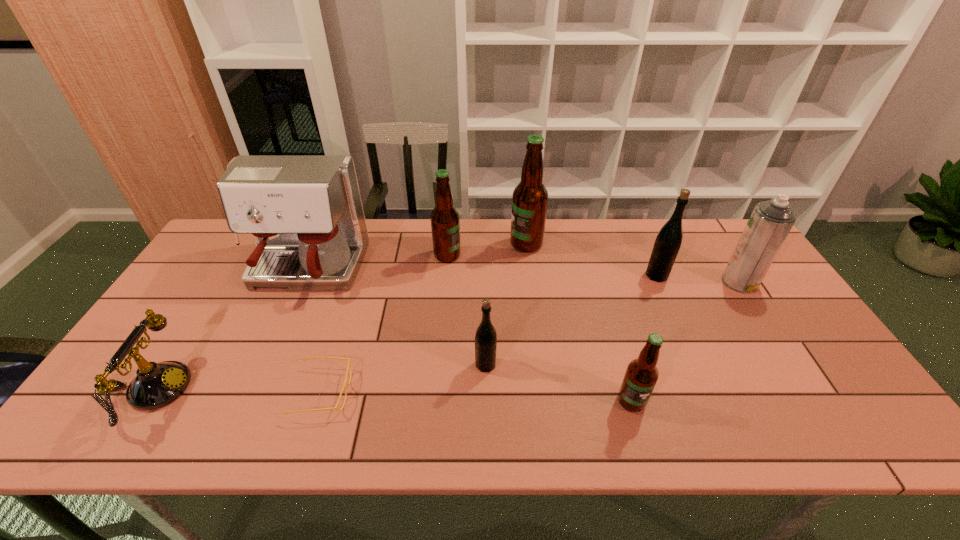
The image size is (960, 540). Find the location of `blank area located on the label of the sixth object from right to left`. blank area located on the label of the sixth object from right to left is located at coordinates (511, 255).

You are a GUI agent. You are given a task and a screenshot of the screen. Output one action in this format:
    pyautogui.click(x=<x>, y=<y>)
    Task: Click on the vacant region located 0.320m on the front of the right green beer bottle
    Image resolution: width=960 pixels, height=540 pixels.
    Given the screenshot: What is the action you would take?
    pyautogui.click(x=700, y=372)

The image size is (960, 540). Find the location of `vacant area situated on the left of the rightmost object`. vacant area situated on the left of the rightmost object is located at coordinates (666, 282).

Identify the location of free space located 0.310m on the left of the fourth beer bottle from right to left. (351, 364).

At what (x,y) coordinates should I click in order to perform the action: click on vacant space located 0.260m on the dial of the telephone. Please return your answer as a coordinate pair (x, y). The height and width of the screenshot is (540, 960). Looking at the image, I should click on (297, 390).

You are a GUI agent. You are given a task and a screenshot of the screen. Output one action in this format:
    pyautogui.click(x=<x>, y=<y>)
    Task: Click on the vacant region located 0.190m in front of the lenses of the beige spectacles
    The height and width of the screenshot is (540, 960).
    Given the screenshot: What is the action you would take?
    pyautogui.click(x=429, y=392)

Where is `coffee maker located in the far edge section of the desktop`? coffee maker located in the far edge section of the desktop is located at coordinates (305, 212).

The height and width of the screenshot is (540, 960). I want to click on beer bottle located at the near edge, so click(x=641, y=375).

Find the location of a particular element. The height and width of the screenshot is (540, 960). telephone that is at the near edge is located at coordinates click(x=156, y=385).

Locate an element on the screen. spectacles present at the near edge is located at coordinates (345, 382).